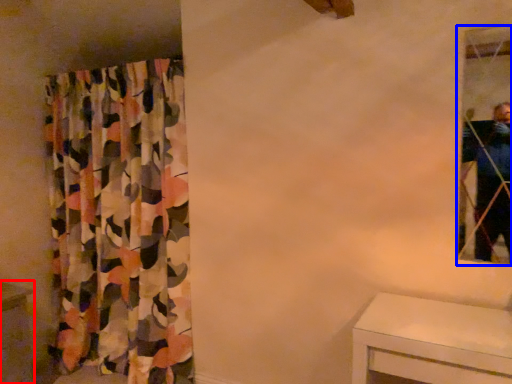
Question: Among these objects, which one is nearest to the camera, vanity (highlighted by a red box) or mirror (highlighted by a blue box)?

Choices:
 (A) vanity
 (B) mirror

Answer: (B)